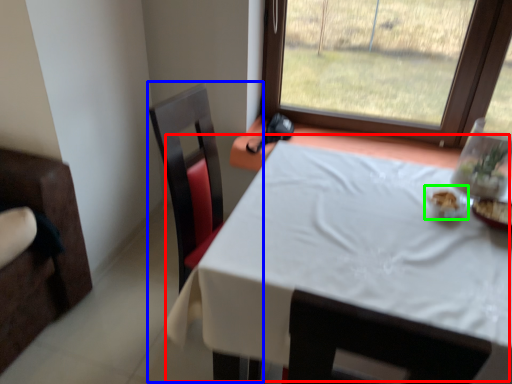
Question: Which is nearer to the table (highlighted by a red box)? swivel chair (highlighted by a blue box) or tableware (highlighted by a green box).

Choices:
 (A) swivel chair
 (B) tableware

Answer: (B)